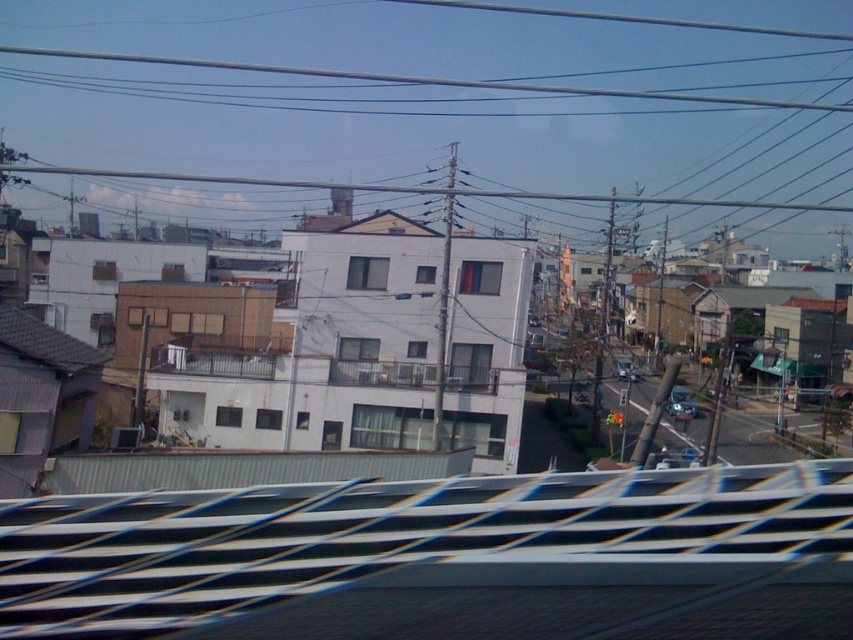
You are standing at the center of the image and want to look at both the metallic wire at upper center and the metallic silver train track at center. Which one do you need to tilt your head upwards more to see?

The metallic wire at upper center has a greater height compared to the metallic silver train track at center, so you need to tilt your head upwards more to see the metallic wire at upper center.

You are a delivery person trying to deliver a package to the residential area. You see the metallic silver train track at center and the metallic blue sedan at center. Which object is lower to the ground?

The metallic silver train track at center is lower to the ground compared to the metallic blue sedan at center.

You are a delivery driver who needs to park your metallic blue sedan at center in a spot that can accommodate its size. There is a metallic silver train track at center nearby. Can you safely park your car next to the train track without overlapping it?

The metallic silver train track at center is smaller than the metallic blue sedan at center. Since the train track is smaller, there should be enough space to park the car next to it without overlapping, provided the track doesn not obstruct the parking area.